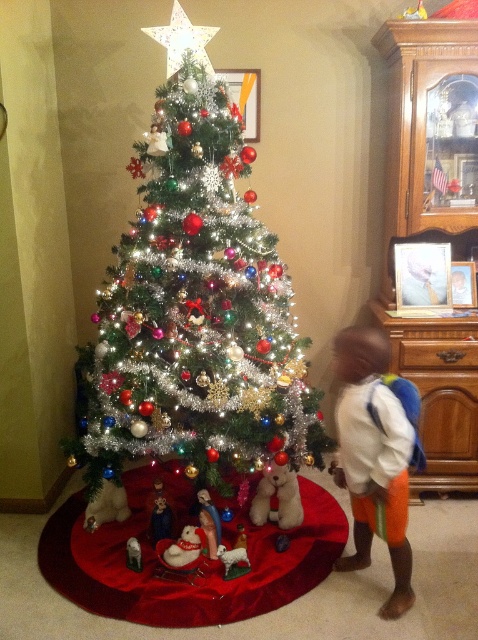
You are standing in front of the Christmas tree and want to place a small gift. You have two points marked as potential spots on the floor near the tree. The first point is at coordinates point (292, 493) and the second is at point (129, 548). Which point is closer to you, the observer, so that you can easily reach it without moving your position?

Point (292, 493) is closer to you than point (129, 548) because it is further to the viewer, making it easier to reach without moving.